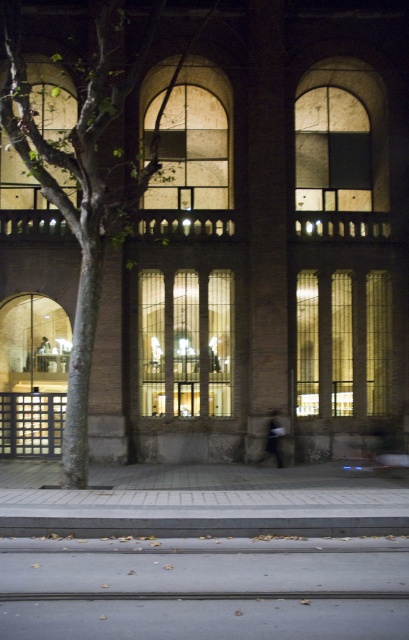
Between gray concrete pavement at lower center and gray concrete curb at lower center, which one is positioned higher?

Positioned higher is gray concrete curb at lower center.

Measure the distance between gray concrete pavement at lower center and camera.

gray concrete pavement at lower center is 25.41 feet away from camera.

Where is `gray concrete pavement at lower center`? The image size is (409, 640). gray concrete pavement at lower center is located at coordinates (204, 588).

Can you confirm if gray concrete pavement at lower center is shorter than green rough bark tree at left?

Indeed, gray concrete pavement at lower center has a lesser height compared to green rough bark tree at left.

Is gray concrete pavement at lower center further to the viewer compared to green rough bark tree at left?

That is False.

Describe the element at coordinates (204, 588) in the screenshot. I see `gray concrete pavement at lower center` at that location.

The width and height of the screenshot is (409, 640). Identify the location of gray concrete pavement at lower center. (204, 588).

Who is taller, green rough bark tree at left or gray concrete curb at lower center?

green rough bark tree at left is taller.

Is green rough bark tree at left behind gray concrete curb at lower center?

Yes, green rough bark tree at left is behind gray concrete curb at lower center.

Between point (179, 61) and point (24, 531), which one is positioned in front?

Positioned in front is point (24, 531).

Find the location of a particular element. This screenshot has width=409, height=640. green rough bark tree at left is located at coordinates (83, 184).